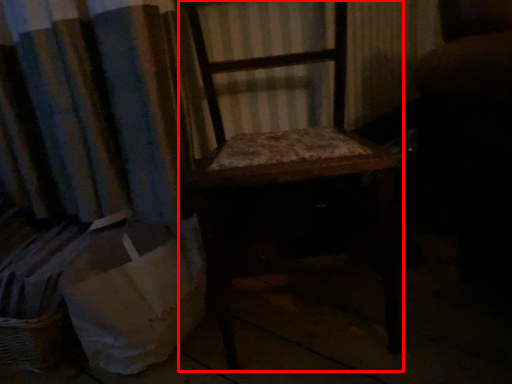
Question: From the image, what is the correct spatial relationship of furniture (annotated by the red box) in relation to shopping bag?

Choices:
 (A) right
 (B) left

Answer: (A)